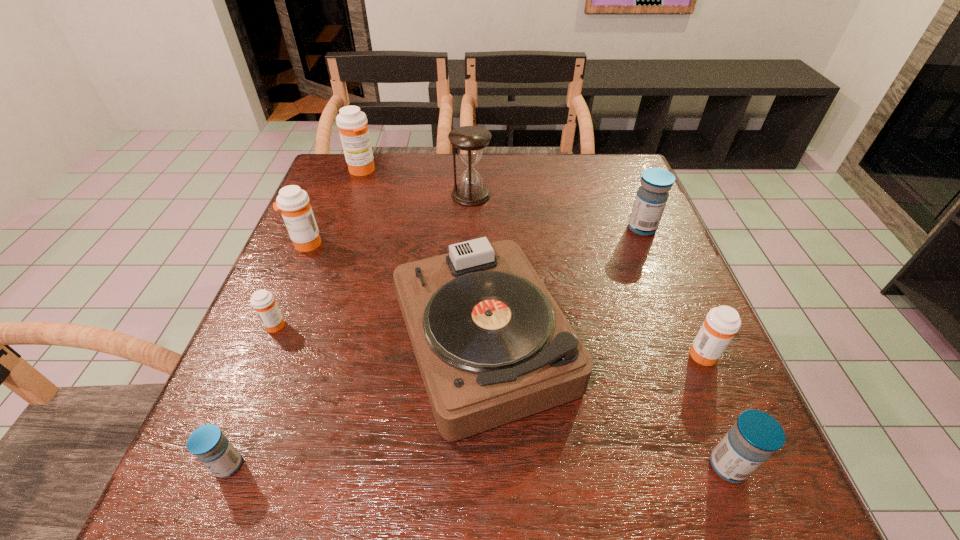
In order to click on the tallest medicine in this screenshot , I will do `click(352, 123)`.

At what (x,y) coordinates should I click in order to perform the action: click on the farthest orange medicine. Please return your answer as a coordinate pair (x, y). The width and height of the screenshot is (960, 540). Looking at the image, I should click on [352, 123].

This screenshot has height=540, width=960. I want to click on hourglass, so click(469, 140).

Where is `the biggest blue medicine`? the biggest blue medicine is located at coordinates (651, 198).

This screenshot has height=540, width=960. In order to click on the third nearest orange medicine in this screenshot , I will do `click(293, 202)`.

This screenshot has height=540, width=960. I want to click on record player, so click(492, 345).

Locate an element on the screen. The image size is (960, 540). the rightmost orange medicine is located at coordinates (721, 324).

Where is `the nearest orange medicine`? The image size is (960, 540). the nearest orange medicine is located at coordinates (721, 324).

Where is `the second smallest blue medicine`? The width and height of the screenshot is (960, 540). the second smallest blue medicine is located at coordinates (756, 435).

Where is `the smallest blue medicine`? This screenshot has width=960, height=540. the smallest blue medicine is located at coordinates (207, 443).